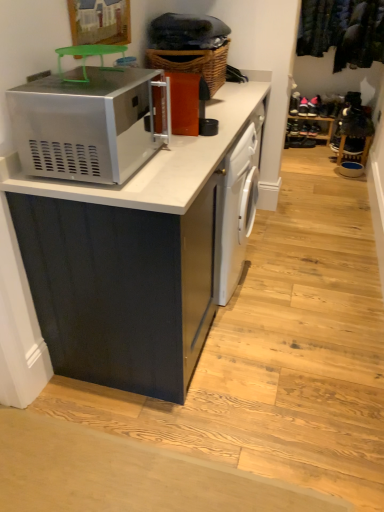
Question: Is dark green fabric at upper right directly adjacent to woven brown basket at upper center?

Choices:
 (A) no
 (B) yes

Answer: (A)

Question: Is woven brown basket at upper center completely or partially inside dark green fabric at upper right?

Choices:
 (A) no
 (B) yes

Answer: (A)

Question: Is dark green fabric at upper right to the left of woven brown basket at upper center from the viewer's perspective?

Choices:
 (A) no
 (B) yes

Answer: (A)

Question: Is dark green fabric at upper right turned away from woven brown basket at upper center?

Choices:
 (A) no
 (B) yes

Answer: (A)

Question: From a real-world perspective, is dark green fabric at upper right below woven brown basket at upper center?

Choices:
 (A) yes
 (B) no

Answer: (A)

Question: Is point (332, 125) positioned closer to the camera than point (180, 357)?

Choices:
 (A) farther
 (B) closer

Answer: (A)

Question: From their relative heights in the image, would you say wooden shoe rack at center is taller or shorter than matte black cabinet at center?

Choices:
 (A) short
 (B) tall

Answer: (A)

Question: From the image's perspective, relative to matte black cabinet at center, is wooden shoe rack at center above or below?

Choices:
 (A) above
 (B) below

Answer: (A)

Question: Is wooden shoe rack at center to the left or to the right of matte black cabinet at center in the image?

Choices:
 (A) left
 (B) right

Answer: (B)

Question: In terms of height, does white glossy dishwasher at center look taller or shorter compared to satin silver microwave at upper left?

Choices:
 (A) tall
 (B) short

Answer: (A)

Question: In terms of width, does white glossy dishwasher at center look wider or thinner when compared to satin silver microwave at upper left?

Choices:
 (A) wide
 (B) thin

Answer: (B)

Question: Is white glossy dishwasher at center situated inside satin silver microwave at upper left or outside?

Choices:
 (A) inside
 (B) outside

Answer: (B)

Question: From the image's perspective, relative to satin silver microwave at upper left, is white glossy dishwasher at center above or below?

Choices:
 (A) below
 (B) above

Answer: (A)

Question: Is woven brown basket at upper center to the left or to the right of satin silver microwave at upper left in the image?

Choices:
 (A) left
 (B) right

Answer: (B)

Question: In terms of width, does woven brown basket at upper center look wider or thinner when compared to satin silver microwave at upper left?

Choices:
 (A) wide
 (B) thin

Answer: (B)